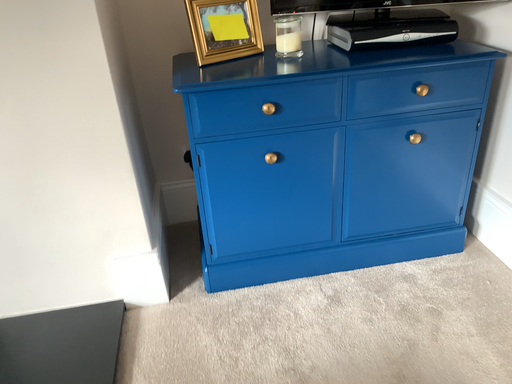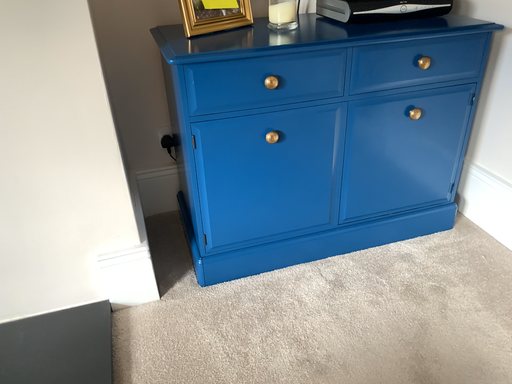
Question: Which way did the camera rotate in the video?

Choices:
 (A) rotated right
 (B) rotated left

Answer: (A)